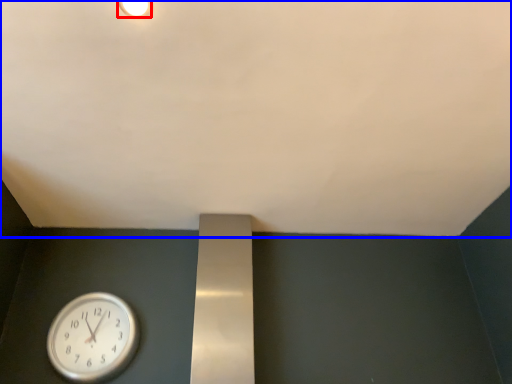
Question: Which point is closer to the camera, light fixture (highlighted by a red box) or backdrop (highlighted by a blue box)?

Choices:
 (A) light fixture
 (B) backdrop

Answer: (B)